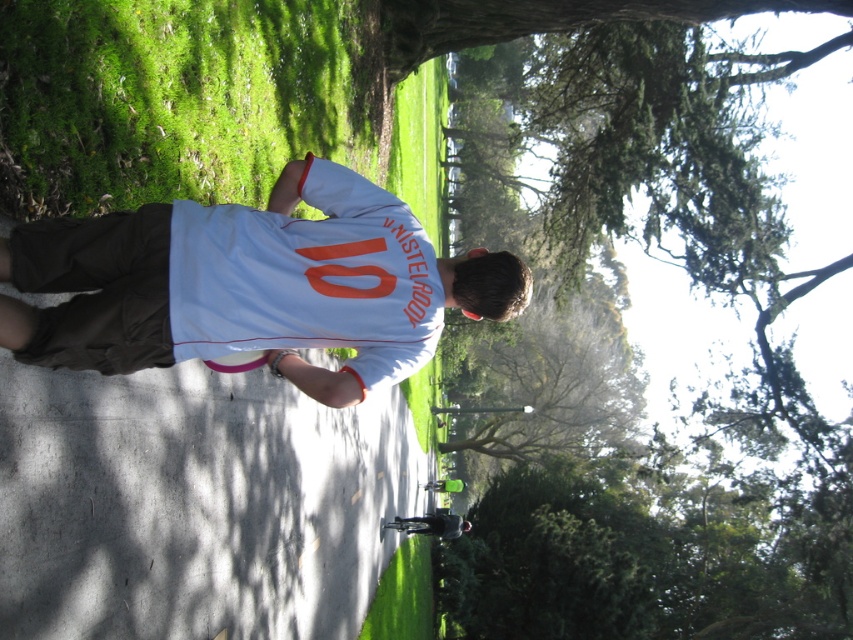
Consider the image. Does green leafy tree at upper center have a lesser height compared to white matte shirt at center?

No.

Who is positioned more to the right, green leafy tree at upper center or white matte shirt at center?

green leafy tree at upper center

Who is more forward, (701,99) or (210,256)?

Point (210,256) is more forward.

Image resolution: width=853 pixels, height=640 pixels. Identify the location of green leafy tree at upper center. (627, 365).

Which is above, white smooth concrete at center or white matte shirt at center?

white matte shirt at center

Can you confirm if white smooth concrete at center is taller than white matte shirt at center?

Indeed, white smooth concrete at center has a greater height compared to white matte shirt at center.

Which is in front, point (300, 468) or point (18, 308)?

Point (18, 308) is in front.

You are a GUI agent. You are given a task and a screenshot of the screen. Output one action in this format:
    pyautogui.click(x=<x>, y=<y>)
    Task: Click on the white smooth concrete at center
    The image size is (853, 640).
    Given the screenshot: What is the action you would take?
    pyautogui.click(x=194, y=504)

Between point (656, 545) and point (285, 422), which one is positioned behind?

The point (656, 545) is more distant.

Does green leafy tree at upper center have a lesser height compared to white smooth concrete at center?

Incorrect, green leafy tree at upper center's height does not fall short of white smooth concrete at center's.

What do you see at coordinates (627, 365) in the screenshot? I see `green leafy tree at upper center` at bounding box center [627, 365].

Identify the location of green leafy tree at upper center. The image size is (853, 640). tap(627, 365).